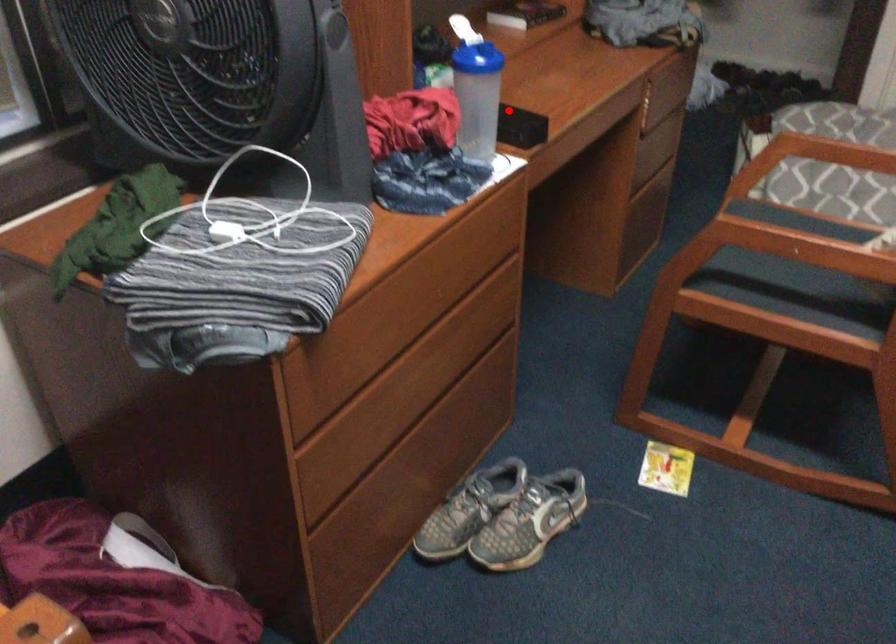
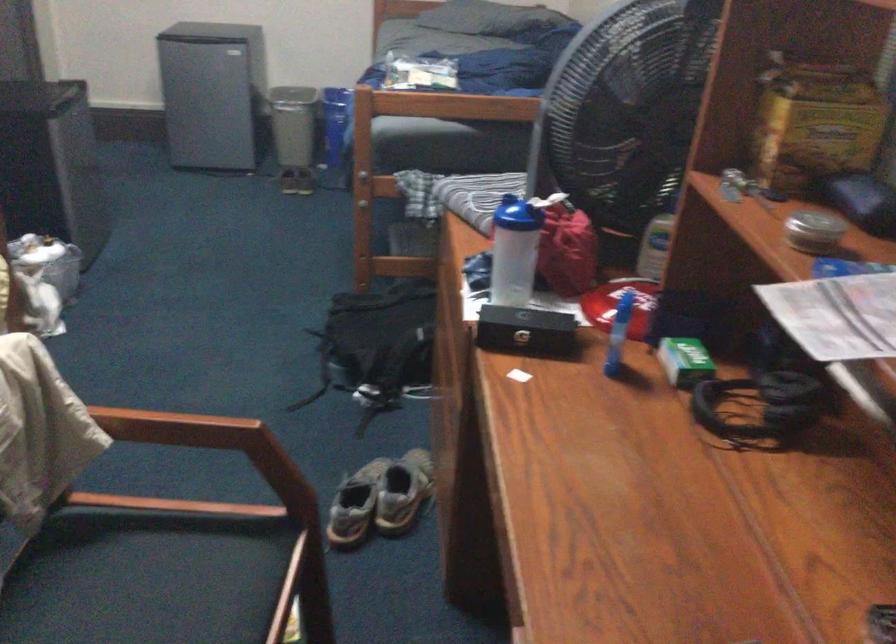
Question: I am providing you with two images of the same scene from different viewpoints. A red point is marked on the first image. Is the red point's position out of view in image 2?

Choices:
 (A) Yes
 (B) No

Answer: (B)